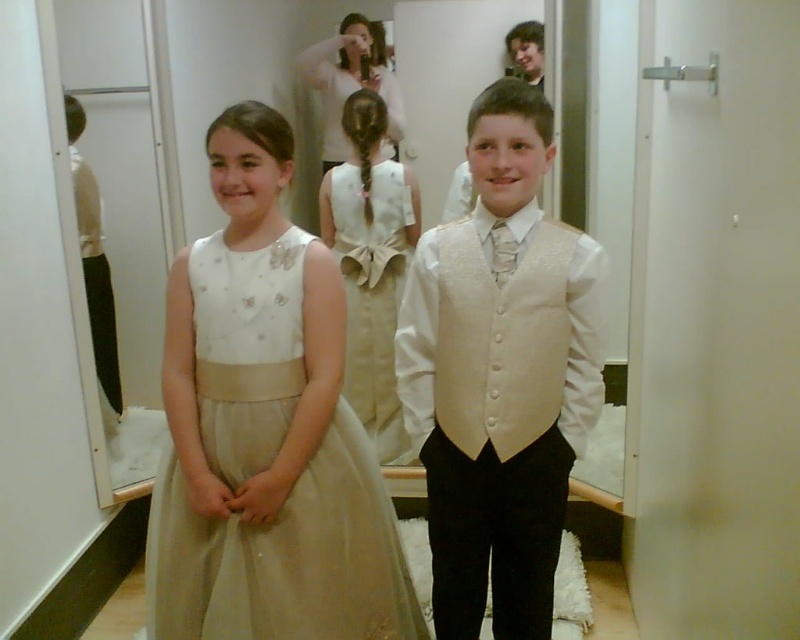
You are a photographer preparing to take a group photo of the two children in the scene. You need to ensure that both the satin white vest at center and the ivory satin dress at center are fully visible in the frame. Given that the vest is wider than the dress, which child should you position closer to the camera to avoid any part of their clothing being cut off?

Since the satin white vest at center is wider than the ivory satin dress at center, you should position the child wearing the satin white vest at center closer to the camera to ensure its full visibility without being cut off.

You are a photographer preparing to take a group photo of the children in the dressing room. You need to ensure that both the satin white vest at center and the matte white tulle dress at center are clearly visible in the reflection of the mirror. Which object should you adjust to be closer to the mirror to ensure its reflection is captured properly?

The satin white vest at center is located above the matte white tulle dress at center. Since the vest is above the dress, adjusting the position of the satin white vest at center closer to the mirror would ensure its reflection is captured clearly in the photo.

You are a photographer setting up for a photoshoot in a fitting room. You need to position two dresses, the matte white tulle dress at center and the ivory satin dress at center, so that they are exactly 4 feet apart. According to the scene description, are the dresses currently positioned correctly?

The matte white tulle dress at center and ivory satin dress at center are 4.08 feet apart, which is slightly more than 4 feet. Therefore, they are not positioned exactly at 4 feet apart.